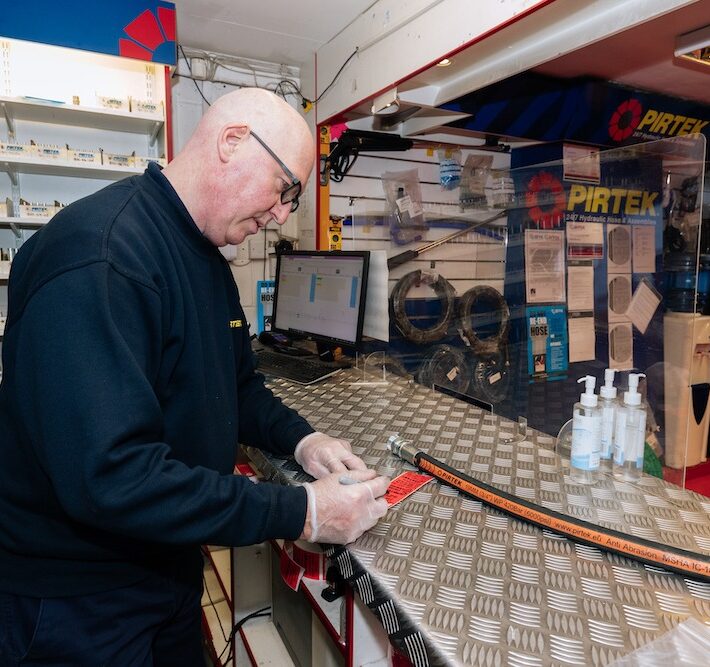
Point out all instances of where you'd dispense the hand santizer in the image. Your answer should be formatted as a list of tuples, i.e. [(x1, y1), (x2, y2), ...], where each tuple contains the x and y coordinates of a point satisfying the conditions above.

[(589, 378), (608, 375), (635, 376)]